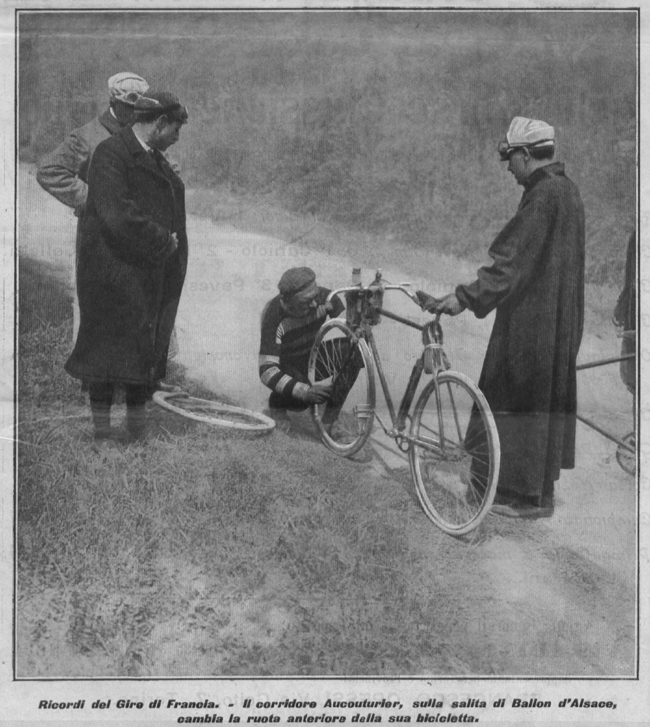
Locate an element on the screen. Image resolution: width=650 pixels, height=727 pixels. coat is located at coordinates point(521,305).